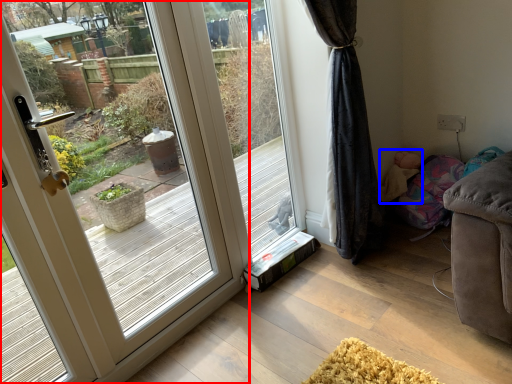
Question: Among these objects, which one is farthest to the camera, door (highlighted by a red box) or child (highlighted by a blue box)?

Choices:
 (A) door
 (B) child

Answer: (B)